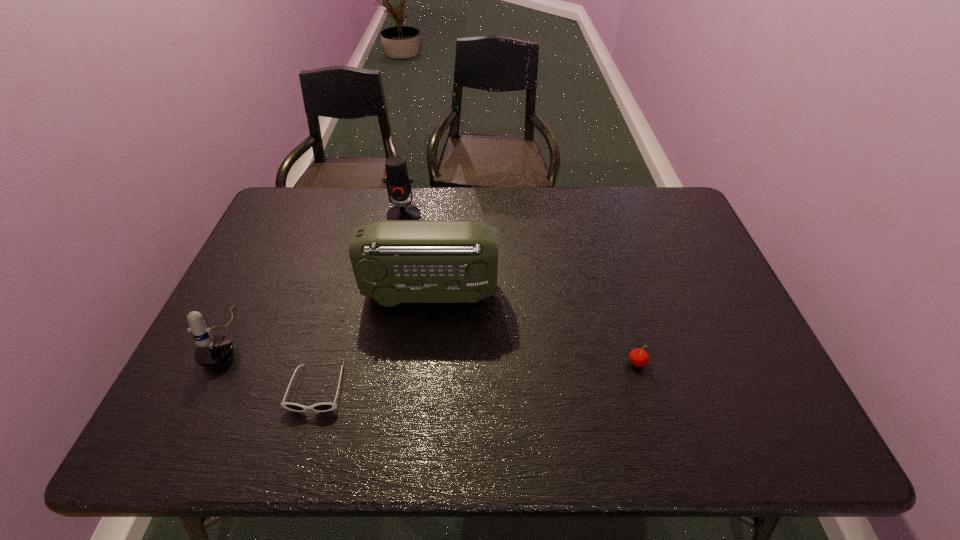
The height and width of the screenshot is (540, 960). In order to click on radio_receiver in this screenshot , I will do `click(394, 261)`.

Identify the location of the right microphone. (398, 184).

Find the location of a particular element. This screenshot has width=960, height=540. the taller microphone is located at coordinates 398,184.

Find the location of a particular element. Image resolution: width=960 pixels, height=540 pixels. the shorter microphone is located at coordinates (212, 350).

Locate an element on the screen. The width and height of the screenshot is (960, 540). the left microphone is located at coordinates (212, 350).

Where is `the rightmost object`? The width and height of the screenshot is (960, 540). the rightmost object is located at coordinates (638, 357).

You are a GUI agent. You are given a task and a screenshot of the screen. Output one action in this format:
    pyautogui.click(x=<x>, y=<y>)
    Task: Click on the fourth tallest object
    This screenshot has width=960, height=540.
    Given the screenshot: What is the action you would take?
    pyautogui.click(x=638, y=357)

At what (x,y) coordinates should I click in order to perform the action: click on the shortest object. Please return your answer as a coordinate pair (x, y). The image size is (960, 540). Looking at the image, I should click on (327, 406).

I want to click on vacant space located on the front-facing side of the radio_receiver, so tap(640, 293).

What are the coordinates of `vacant space situated 0.370m on the side of the farthest object with the red ring` in the screenshot? It's located at (385, 316).